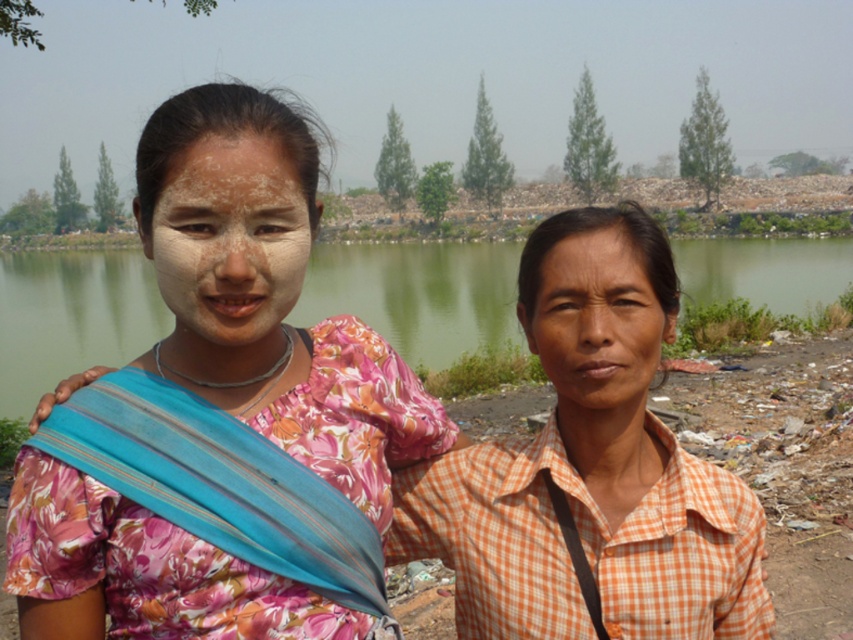
You are standing at point (485, 324) and want to walk to point (474, 452). Which direction should you move relative to your current position?

Since point (474, 452) is in front of point (485, 324), you should move forward to reach it.